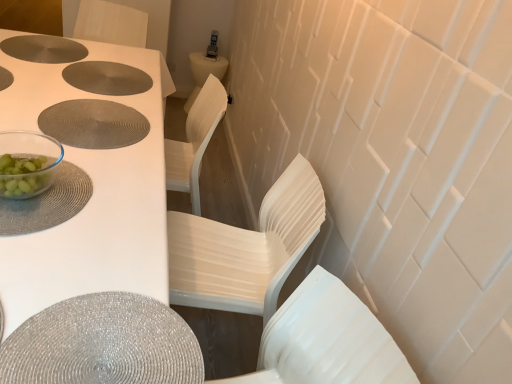
Locate an element on the screen. vacant space underneath matte gray placemat at upper left, the second hole positioned from the bottom (from a real-world perspective) is located at coordinates (102, 73).